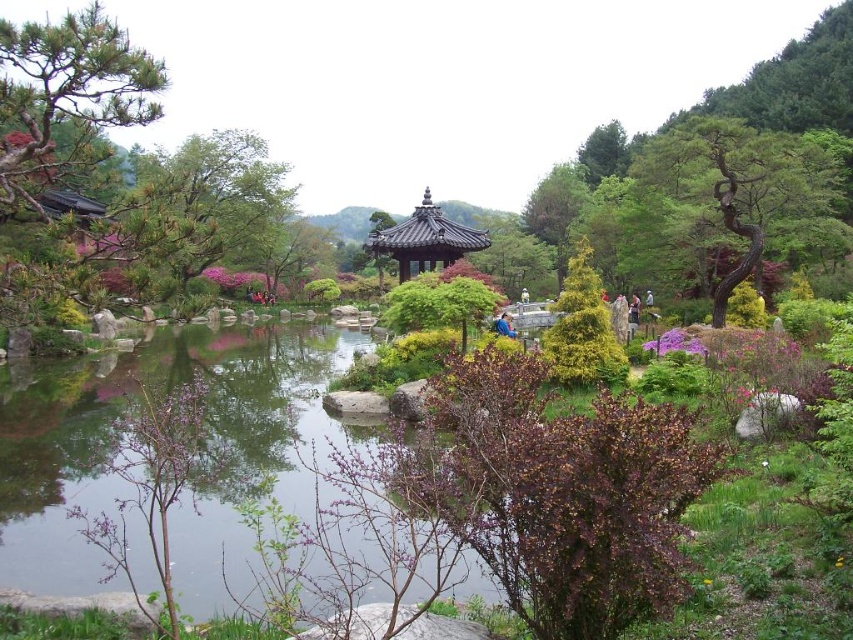
Does bare bark tree at upper right come in front of shiny dark brown gazebo at center?

Yes, bare bark tree at upper right is closer to the viewer.

At what (x,y) coordinates should I click in order to perform the action: click on bare bark tree at upper right. Please return your answer as a coordinate pair (x, y). The height and width of the screenshot is (640, 853). Looking at the image, I should click on (750, 189).

The width and height of the screenshot is (853, 640). I want to click on bare bark tree at upper right, so click(750, 189).

Where is `bare bark tree at upper right`? bare bark tree at upper right is located at coordinates (750, 189).

Based on the photo, who is lower down, bare bark tree at upper right or green textured bush at center?

green textured bush at center is lower down.

Is point (706, 131) positioned after point (577, 360)?

Yes.

Locate an element on the screen. The height and width of the screenshot is (640, 853). bare bark tree at upper right is located at coordinates (750, 189).

Based on the photo, can you confirm if shiny dark brown gazebo at center is taller than purple matte flower at center-right?

Correct, shiny dark brown gazebo at center is much taller as purple matte flower at center-right.

Is shiny dark brown gazebo at center below purple matte flower at center-right?

No, shiny dark brown gazebo at center is not below purple matte flower at center-right.

Between point (428, 248) and point (672, 336), which one is positioned behind?

Positioned behind is point (428, 248).

The width and height of the screenshot is (853, 640). In order to click on shiny dark brown gazebo at center in this screenshot , I will do `click(425, 240)`.